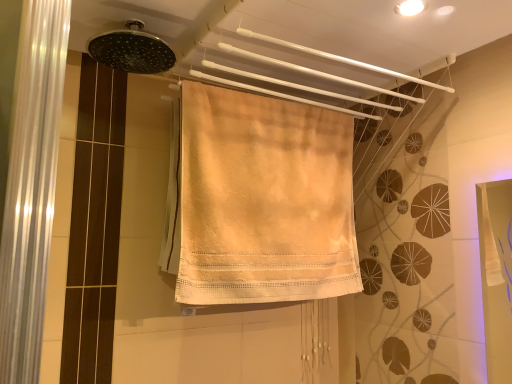
The image size is (512, 384). In order to click on free space above matte black shower head at upper center (from a real-world perspective) in this screenshot , I will do `click(136, 23)`.